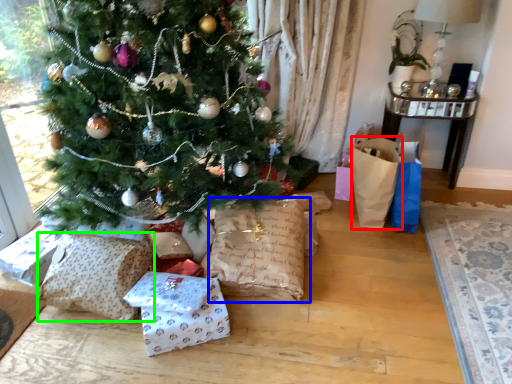
Question: Considering the real-world distances, which object is farthest from gift bag (highlighted by a red box)? sack (highlighted by a blue box) or sack (highlighted by a green box)?

Choices:
 (A) sack
 (B) sack

Answer: (B)